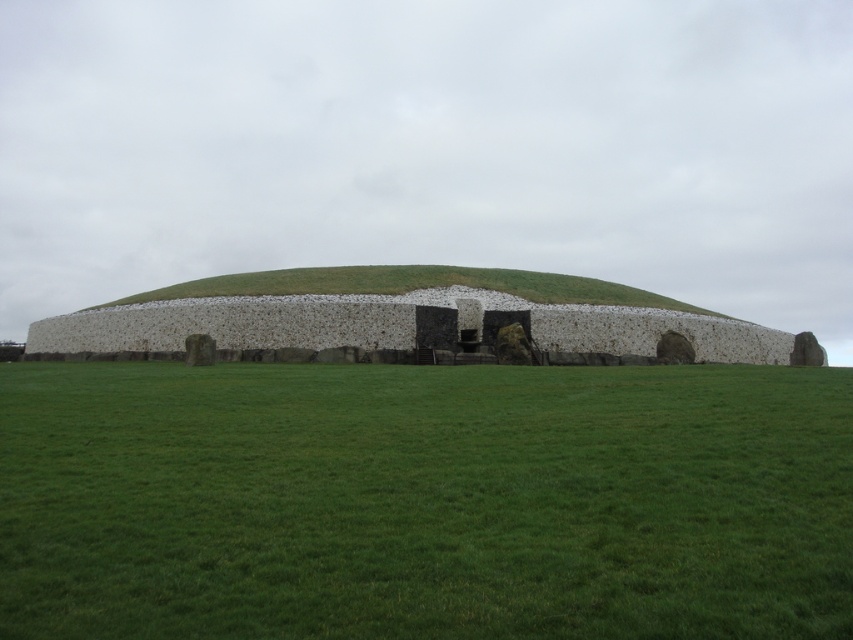
Is green grass at center shorter than green grassy mound at center?

Yes.

Identify the location of green grass at center. The width and height of the screenshot is (853, 640). (424, 500).